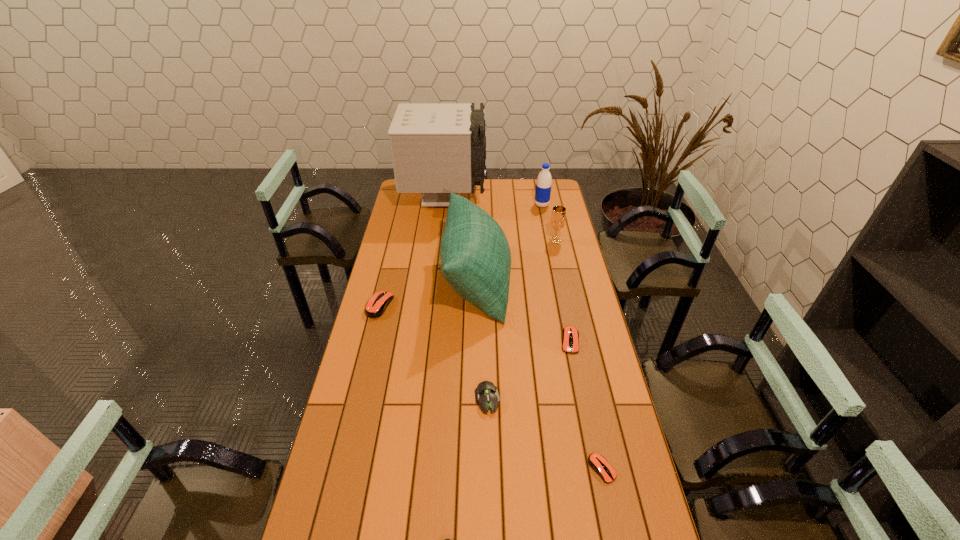
This screenshot has width=960, height=540. I want to click on the tallest object, so click(437, 148).

Find the location of a particular element. gray fan is located at coordinates (437, 148).

Where is `the second tallest object`? the second tallest object is located at coordinates (475, 256).

Locate an element on the screen. blue water bottle is located at coordinates (543, 186).

This screenshot has width=960, height=540. Identify the location of the seventh shortest object. pos(543,186).

Locate an element on the screen. The width and height of the screenshot is (960, 540). the sixth shortest object is located at coordinates coord(557,222).

Identify the location of the leftmost computer mouse. (376, 306).

At what (x,y) coordinates should I click in order to perform the action: click on the tallest computer mouse. Please return your answer as a coordinate pair (x, y). Looking at the image, I should click on (376, 306).

The width and height of the screenshot is (960, 540). Identify the location of the fourth nearest computer mouse. (570, 336).

This screenshot has width=960, height=540. I want to click on the second smallest orange computer mouse, so click(570, 336).